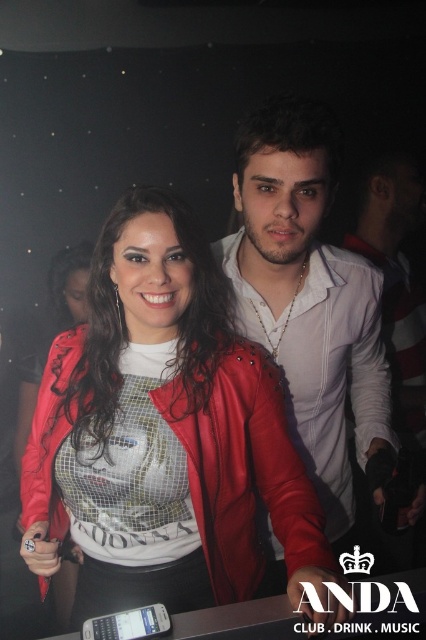
Question: Is shiny red leather jacket at center to the left of matte white shirt at center from the viewer's perspective?

Choices:
 (A) yes
 (B) no

Answer: (A)

Question: Among these points, which one is farthest from the camera?

Choices:
 (A) (86, 566)
 (B) (247, 291)

Answer: (B)

Question: Where is shiny red leather jacket at center located in relation to matte white shirt at center in the image?

Choices:
 (A) right
 (B) left

Answer: (B)

Question: Does shiny red leather jacket at center have a greater width compared to matte white shirt at center?

Choices:
 (A) yes
 (B) no

Answer: (A)

Question: Among these objects, which one is farthest from the camera?

Choices:
 (A) matte white shirt at center
 (B) shiny red leather jacket at center

Answer: (A)